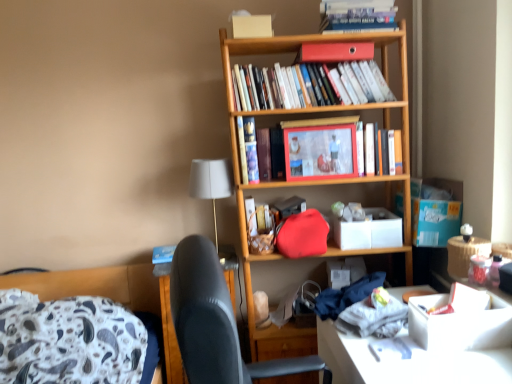
Question: Is hardcover book at center, the 1th book from the bottom, taller than matte red handbag at center?

Choices:
 (A) no
 (B) yes

Answer: (B)

Question: From the image's perspective, is hardcover book at center, the 1th book from the bottom, on matte red handbag at center?

Choices:
 (A) yes
 (B) no

Answer: (A)

Question: Does hardcover book at center, which is the fourth book from top to bottom, appear on the left side of matte red handbag at center?

Choices:
 (A) yes
 (B) no

Answer: (B)

Question: Would you say hardcover book at center, the 1th book from the bottom, is outside matte red handbag at center?

Choices:
 (A) no
 (B) yes

Answer: (B)

Question: Is hardcover book at center, which is the fourth book from top to bottom, beside matte red handbag at center?

Choices:
 (A) no
 (B) yes

Answer: (A)

Question: Considering the positions of matte red book at upper center and matte red handbag at center in the image, is matte red book at upper center wider or thinner than matte red handbag at center?

Choices:
 (A) thin
 (B) wide

Answer: (B)

Question: From a real-world perspective, relative to matte red handbag at center, is matte red book at upper center vertically above or below?

Choices:
 (A) above
 (B) below

Answer: (A)

Question: Is matte red book at upper center inside or outside of matte red handbag at center?

Choices:
 (A) inside
 (B) outside

Answer: (B)

Question: Is matte red book at upper center bigger or smaller than matte red handbag at center?

Choices:
 (A) small
 (B) big

Answer: (B)

Question: Is matte red book at upper center to the left or to the right of hardcover books at upper center, placed as the 3th book when sorted from bottom to top, in the image?

Choices:
 (A) right
 (B) left

Answer: (A)

Question: Does point (354, 46) appear closer or farther from the camera than point (294, 96)?

Choices:
 (A) closer
 (B) farther

Answer: (A)

Question: Is matte red book at upper center inside the boundaries of hardcover books at upper center, arranged as the 2th book when viewed from the top, or outside?

Choices:
 (A) outside
 (B) inside

Answer: (B)

Question: In terms of height, does matte red book at upper center look taller or shorter compared to hardcover books at upper center, arranged as the 2th book when viewed from the top?

Choices:
 (A) short
 (B) tall

Answer: (A)

Question: From a real-world perspective, relative to hardcover book at upper center, the fourth book ordered from the bottom, is blue cardboard box at right, the second cardboard box positioned from the left, vertically above or below?

Choices:
 (A) above
 (B) below

Answer: (B)

Question: In the image, is blue cardboard box at right, the second cardboard box positioned from the left, positioned in front of or behind hardcover book at upper center, the fourth book ordered from the bottom?

Choices:
 (A) front
 (B) behind

Answer: (B)